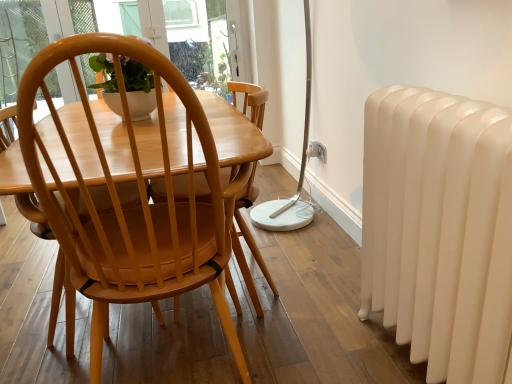
Identify the location of white plastic electric outlet at center. This screenshot has width=512, height=384. (314, 149).

The image size is (512, 384). What do you see at coordinates (439, 229) in the screenshot?
I see `white glossy radiator at right` at bounding box center [439, 229].

You are a GUI agent. You are given a task and a screenshot of the screen. Output one action in this format:
    pyautogui.click(x=<x>, y=<y>)
    Task: Click on the white plastic electric outlet at center
    
    Given the screenshot: What is the action you would take?
    pyautogui.click(x=314, y=149)

Is the position of matte wood chair at center more distant than that of white plastic electric outlet at center?

No, matte wood chair at center is closer to the camera.

You are a GUI agent. You are given a task and a screenshot of the screen. Output one action in this format:
    pyautogui.click(x=<x>, y=<y>)
    Task: Click on the chair lying in front of the white plastic electric outlet at center
    Image resolution: width=512 pixels, height=384 pixels.
    Given the screenshot: What is the action you would take?
    pyautogui.click(x=132, y=205)

Is matte wood chair at center placed right next to white plastic electric outlet at center?

They are not placed beside each other.

Is point (192, 285) in front of point (316, 152)?

Yes, point (192, 285) is closer to viewer.

Is white plastic power outlet at lower center wider than white plastic electric outlet at center?

In fact, white plastic power outlet at lower center might be narrower than white plastic electric outlet at center.

You are a GUI agent. You are given a task and a screenshot of the screen. Output one action in this format:
    pyautogui.click(x=<x>, y=<y>)
    Task: Click on the power outlet below the white plastic electric outlet at center (from a real-world perspective)
    
    Given the screenshot: What is the action you would take?
    pyautogui.click(x=317, y=151)

Which object is more forward, white plastic power outlet at lower center or white plastic electric outlet at center?

white plastic power outlet at lower center is in front.

Is white plastic power outlet at lower center with white plastic electric outlet at center?

Yes, white plastic power outlet at lower center is beside white plastic electric outlet at center.

From the image's perspective, which one is positioned lower, white plastic power outlet at lower center or matte wood chair at center?

From the image's view, matte wood chair at center is below.

This screenshot has height=384, width=512. I want to click on power outlet below the matte wood chair at center (from a real-world perspective), so point(317,151).

Is white plastic power outlet at lower center completely or partially outside of matte wood chair at center?

Yes, white plastic power outlet at lower center is not within matte wood chair at center.

Considering the positions of points (313, 154) and (186, 246), is point (313, 154) farther from camera compared to point (186, 246)?

Yes.

Who is taller, white plastic electric outlet at center or white plastic power outlet at lower center?

Standing taller between the two is white plastic electric outlet at center.

Is white plastic electric outlet at center with white plastic power outlet at lower center?

Yes, white plastic electric outlet at center is beside white plastic power outlet at lower center.

Considering the relative positions of white plastic electric outlet at center and white plastic power outlet at lower center in the image provided, is white plastic electric outlet at center to the right of white plastic power outlet at lower center from the viewer's perspective?

In fact, white plastic electric outlet at center is to the left of white plastic power outlet at lower center.

Considering the sizes of objects white glossy radiator at right and white plastic electric outlet at center in the image provided, who is shorter, white glossy radiator at right or white plastic electric outlet at center?

white plastic electric outlet at center is shorter.

Can you confirm if white glossy radiator at right is wider than white plastic electric outlet at center?

Yes, white glossy radiator at right is wider than white plastic electric outlet at center.

From a real-world perspective, which object stands above the other?

white glossy radiator at right is physically above.

Which object is positioned more to the left, white glossy radiator at right or white plastic electric outlet at center?

From the viewer's perspective, white plastic electric outlet at center appears more on the left side.

Is matte wood chair at center looking in the opposite direction of white plastic power outlet at lower center?

No, white plastic power outlet at lower center is not at the back of matte wood chair at center.

Is matte wood chair at center touching white plastic power outlet at lower center?

matte wood chair at center and white plastic power outlet at lower center are not in contact.

From the image's perspective, which is below, matte wood chair at center or white plastic power outlet at lower center?

matte wood chair at center.

Considering the relative sizes of matte wood chair at center and white plastic power outlet at lower center in the image provided, is matte wood chair at center smaller than white plastic power outlet at lower center?

Incorrect, matte wood chair at center is not smaller in size than white plastic power outlet at lower center.

Is matte wood chair at center inside white glossy radiator at right?

Definitely not — matte wood chair at center is not inside white glossy radiator at right.

Considering the points (445, 190) and (79, 79), which point is in front, point (445, 190) or point (79, 79)?

The point (445, 190) is closer to the camera.

From the picture: Considering the positions of objects white glossy radiator at right and matte wood chair at center in the image provided, who is in front, white glossy radiator at right or matte wood chair at center?

matte wood chair at center is closer to the camera.

Between white glossy radiator at right and matte wood chair at center, which one has larger size?

matte wood chair at center is bigger.

Where is `chair in front of the white plastic electric outlet at center`? This screenshot has width=512, height=384. chair in front of the white plastic electric outlet at center is located at coordinates (132, 205).

Find the location of a particular element. Image resolution: width=512 pixels, height=384 pixels. electric outlet on the left of white plastic power outlet at lower center is located at coordinates (314, 149).

When comparing their distances from white plastic power outlet at lower center, does white plastic electric outlet at center or matte wood chair at center seem further?

The object further to white plastic power outlet at lower center is matte wood chair at center.

Looking at the image, which one is located further to white plastic power outlet at lower center, matte wood chair at center or white glossy radiator at right?

matte wood chair at center lies further to white plastic power outlet at lower center than the other object.

Which object lies nearer to the anchor point white plastic power outlet at lower center, white plastic electric outlet at center or white glossy radiator at right?

white plastic electric outlet at center is positioned closer to the anchor white plastic power outlet at lower center.

Estimate the real-world distances between objects in this image. Which object is further from white glossy radiator at right, white plastic power outlet at lower center or matte wood chair at center?

white plastic power outlet at lower center is positioned further to the anchor white glossy radiator at right.

Estimate the real-world distances between objects in this image. Which object is further from white glossy radiator at right, white plastic power outlet at lower center or white plastic electric outlet at center?

Answer: Based on the image, white plastic electric outlet at center appears to be further to white glossy radiator at right.

Which object lies nearer to the anchor point white plastic electric outlet at center, matte wood chair at center or white glossy radiator at right?

Among the two, white glossy radiator at right is located nearer to white plastic electric outlet at center.

From the image, which object appears to be nearer to white plastic electric outlet at center, white plastic power outlet at lower center or matte wood chair at center?

Based on the image, white plastic power outlet at lower center appears to be nearer to white plastic electric outlet at center.

When comparing their distances from white plastic power outlet at lower center, does matte wood chair at center or white plastic electric outlet at center seem further?

The object further to white plastic power outlet at lower center is matte wood chair at center.

Where is `radiator between matte wood chair at center and white plastic power outlet at lower center along the z-axis`? radiator between matte wood chair at center and white plastic power outlet at lower center along the z-axis is located at coordinates (439, 229).

Find the location of a particular element. power outlet between matte wood chair at center and white plastic electric outlet at center from front to back is located at coordinates (317, 151).

The height and width of the screenshot is (384, 512). Find the location of `radiator between matte wood chair at center and white plastic electric outlet at center from front to back`. radiator between matte wood chair at center and white plastic electric outlet at center from front to back is located at coordinates (439, 229).

Identify the location of power outlet between white glossy radiator at right and white plastic electric outlet at center in the front-back direction. (317, 151).